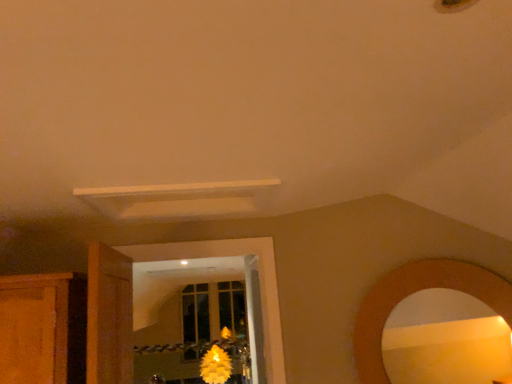
In order to face wooden mirror at lower right, should I rotate leftwards or rightwards?

Turn right by 22.264 degrees to look at wooden mirror at lower right.

Locate an element on the screen. The width and height of the screenshot is (512, 384). yellow matte flower at center is located at coordinates (215, 366).

Is point (389, 354) more distant than point (98, 346)?

Yes, point (389, 354) is farther from viewer.

From a real-world perspective, which object stands above the other?

wooden door at left, from a real-world perspective.

Which of these two, wooden mirror at lower right or wooden door at left, is thinner?

With smaller width is wooden mirror at lower right.

Identify the location of mirror above the yellow matte flower at center (from a real-world perspective). (445, 340).

Does yellow matte flower at center lie behind wooden mirror at lower right?

That is True.

Does yellow matte flower at center appear on the right side of wooden mirror at lower right?

No, yellow matte flower at center is not to the right of wooden mirror at lower right.

Consider the image. Between wooden mirror at lower right and yellow matte flower at center, which one appears on the left side from the viewer's perspective?

From the viewer's perspective, yellow matte flower at center appears more on the left side.

Can you confirm if wooden mirror at lower right is bigger than yellow matte flower at center?

Incorrect, wooden mirror at lower right is not larger than yellow matte flower at center.

Does wooden mirror at lower right have a greater width compared to yellow matte flower at center?

No.

Who is taller, wooden mirror at lower right or yellow matte flower at center?

yellow matte flower at center.

Find the location of a particular element. door in front of the yellow matte flower at center is located at coordinates (109, 316).

Does yellow matte flower at center have a larger size compared to wooden door at left?

Correct, yellow matte flower at center is larger in size than wooden door at left.

Looking at this image, are yellow matte flower at center and wooden door at left located far from each other?

Yes, yellow matte flower at center and wooden door at left are located far from each other.

Looking at this image, is yellow matte flower at center surrounding wooden door at left?

No, wooden door at left is not surrounded by yellow matte flower at center.

Would you say wooden door at left is to the left or to the right of yellow matte flower at center in the picture?

Based on their positions, wooden door at left is located to the right of yellow matte flower at center.

Where is `flower behind the wooden door at left`? flower behind the wooden door at left is located at coordinates (215, 366).

Does wooden door at left lie behind yellow matte flower at center?

No, it is in front of yellow matte flower at center.

Considering the sizes of objects wooden door at left and wooden mirror at lower right in the image provided, who is bigger, wooden door at left or wooden mirror at lower right?

wooden door at left is bigger.

From a real-world perspective, is wooden door at left positioned over wooden mirror at lower right based on gravity?

Yes, from a real-world perspective, wooden door at left is on top of wooden mirror at lower right.

Which is more distant, (90, 336) or (473, 369)?

Point (473, 369)

How many degrees apart are the facing directions of wooden door at left and wooden mirror at lower right?

The angular difference between wooden door at left and wooden mirror at lower right is 134 degrees.

Find the location of a particular element. The width and height of the screenshot is (512, 384). mirror behind the wooden door at left is located at coordinates (445, 340).

You are a GUI agent. You are given a task and a screenshot of the screen. Output one action in this format:
    pyautogui.click(x=<x>, y=<y>)
    Task: Click on the mirror above the yellow matte flower at center (from the image's perspective)
    This screenshot has height=384, width=512.
    Given the screenshot: What is the action you would take?
    pyautogui.click(x=445, y=340)

Based on their spatial positions, is yellow matte flower at center or wooden mirror at lower right closer to wooden door at left?

wooden mirror at lower right.

Which object lies further to the anchor point wooden mirror at lower right, yellow matte flower at center or wooden door at left?

yellow matte flower at center is positioned further to the anchor wooden mirror at lower right.

Based on their spatial positions, is wooden door at left or wooden mirror at lower right closer to yellow matte flower at center?

Based on the image, wooden door at left appears to be nearer to yellow matte flower at center.

Looking at this image, which object lies nearer to the anchor point yellow matte flower at center, wooden mirror at lower right or wooden door at left?

wooden door at left lies closer to yellow matte flower at center than the other object.

In the scene shown: From the image, which object appears to be nearer to wooden door at left, wooden mirror at lower right or yellow matte flower at center?

wooden mirror at lower right is positioned closer to the anchor wooden door at left.

From the image, which object appears to be nearer to wooden mirror at lower right, wooden door at left or yellow matte flower at center?

The object closer to wooden mirror at lower right is wooden door at left.

I want to click on mirror between wooden door at left and yellow matte flower at center in the front-back direction, so click(445, 340).